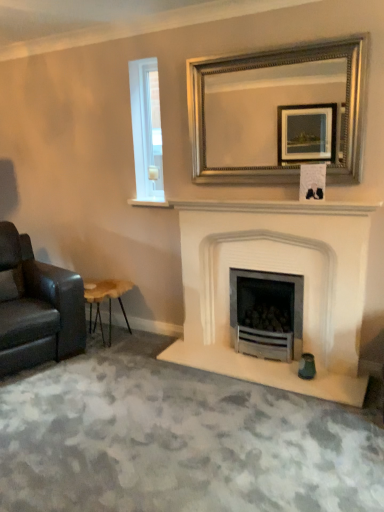
Question: Looking at the image, does white glass window at upper left seem bigger or smaller compared to silver/golden metallic mirror at upper center?

Choices:
 (A) big
 (B) small

Answer: (B)

Question: From a real-world perspective, relative to silver/golden metallic mirror at upper center, is white glass window at upper left vertically above or below?

Choices:
 (A) above
 (B) below

Answer: (B)

Question: Based on their relative distances, which object is farther from the silver/golden metallic mirror at upper center?

Choices:
 (A) wooden stool at lower left
 (B) white stone fireplace at center
 (C) white glass window at upper left
 (D) leather couch at left
 (E) white marble fireplace at center

Answer: (D)

Question: Which object is the farthest from the white marble fireplace at center?

Choices:
 (A) silver/golden metallic mirror at upper center
 (B) leather couch at left
 (C) white glass window at upper left
 (D) wooden stool at lower left
 (E) white stone fireplace at center

Answer: (B)